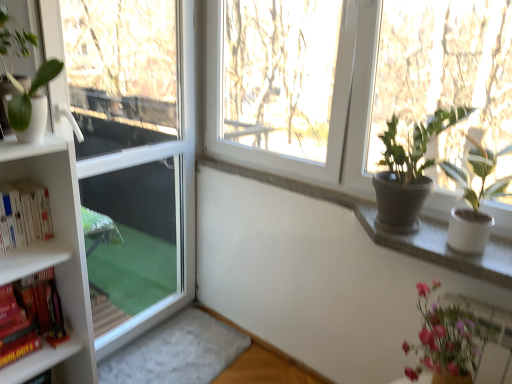
Describe the element at coordinates (15, 77) in the screenshot. I see `matte white pot at left, which ranks as the 1th houseplant in top-to-bottom order` at that location.

Find the location of `transparent glass screen door at left`. transparent glass screen door at left is located at coordinates (181, 192).

Does point (430, 187) appear closer or farther from the camera than point (7, 15)?

Point (430, 187) is farther from the camera than point (7, 15).

Which is more to the left, matte gray pot at upper right, acting as the second houseplant starting from the bottom, or matte white pot at left, placed as the third houseplant when sorted from right to left?

matte white pot at left, placed as the third houseplant when sorted from right to left.

Choose the correct answer: Is matte gray pot at upper right, marked as the 2th houseplant in a left-to-right arrangement, inside matte white pot at left, placed as the third houseplant when sorted from right to left, or outside it?

matte gray pot at upper right, marked as the 2th houseplant in a left-to-right arrangement, exists outside the volume of matte white pot at left, placed as the third houseplant when sorted from right to left.

Based on the photo, can matte gray pot at upper right, the 2th houseplant in the top-to-bottom sequence, be found inside matte white pot at left, which ranks as the 1th houseplant in top-to-bottom order?

No, matte gray pot at upper right, the 2th houseplant in the top-to-bottom sequence, is not inside matte white pot at left, which ranks as the 1th houseplant in top-to-bottom order.

Is matte white pot at left, acting as the 1th houseplant starting from the left, positioned with its back to matte gray pot at upper right, placed as the second houseplant when sorted from right to left?

matte white pot at left, acting as the 1th houseplant starting from the left, does not have its back to matte gray pot at upper right, placed as the second houseplant when sorted from right to left.

Is matte white pot at left, acting as the 1th houseplant starting from the left, shorter than matte gray pot at upper right, the 2th houseplant in the top-to-bottom sequence?

Yes, matte white pot at left, acting as the 1th houseplant starting from the left, is shorter than matte gray pot at upper right, the 2th houseplant in the top-to-bottom sequence.

Which is more to the left, matte white pot at left, acting as the 1th houseplant starting from the left, or matte gray pot at upper right, the 2th houseplant in the top-to-bottom sequence?

matte white pot at left, acting as the 1th houseplant starting from the left, is more to the left.

Who is shorter, pink glossy vase at lower right, which is the 3th houseplant from top to bottom, or hardcover books at left, the second book from the top?

hardcover books at left, the second book from the top, is shorter.

Which is behind, point (473, 324) or point (52, 279)?

The point (52, 279) is farther from the camera.

From a real-world perspective, between pink glossy vase at lower right, acting as the first houseplant starting from the right, and hardcover books at left, the second book from the top, who is vertically higher?

pink glossy vase at lower right, acting as the first houseplant starting from the right, is physically above.

Visually, is transparent glass screen door at left positioned to the left or to the right of matte white pot at left, which ranks as the 1th houseplant in top-to-bottom order?

Clearly, transparent glass screen door at left is on the right of matte white pot at left, which ranks as the 1th houseplant in top-to-bottom order, in the image.

From a real-world perspective, who is located lower, transparent glass screen door at left or matte white pot at left, acting as the 1th houseplant starting from the left?

transparent glass screen door at left is physically lower.

Is the position of transparent glass screen door at left less distant than that of matte white pot at left, which is the third houseplant in bottom-to-top order?

No, transparent glass screen door at left is further to the viewer.

Is transparent glass screen door at left taller or shorter than matte white pot at left, acting as the 1th houseplant starting from the left?

transparent glass screen door at left is taller than matte white pot at left, acting as the 1th houseplant starting from the left.

Between transparent glass screen door at left and hardcover books at left, placed as the 1th book when sorted from top to bottom, which one is positioned in front?

hardcover books at left, placed as the 1th book when sorted from top to bottom.

Identify the location of screen door on the right of hardcover books at left, placed as the 1th book when sorted from top to bottom. This screenshot has height=384, width=512. (181, 192).

Is transparent glass screen door at left turned away from hardcover books at left, which is the 2th book in bottom-to-top order?

transparent glass screen door at left does not have its back to hardcover books at left, which is the 2th book in bottom-to-top order.

From the picture: Is hardcover books at left, which is the 2th book in bottom-to-top order, located within transparent glass screen door at left?

No, transparent glass screen door at left does not contain hardcover books at left, which is the 2th book in bottom-to-top order.

How many degrees apart are the facing directions of matte white pot at left, which is the third houseplant in bottom-to-top order, and white ceramic pot at upper right?

88.7 degrees.

Measure the distance between matte white pot at left, which ranks as the 1th houseplant in top-to-bottom order, and white ceramic pot at upper right.

matte white pot at left, which ranks as the 1th houseplant in top-to-bottom order, and white ceramic pot at upper right are 1.29 meters apart.

Which of these two, matte white pot at left, which ranks as the 1th houseplant in top-to-bottom order, or white ceramic pot at upper right, stands shorter?

Standing shorter between the two is white ceramic pot at upper right.

Is matte white pot at left, which ranks as the 1th houseplant in top-to-bottom order, positioned behind white ceramic pot at upper right?

No, matte white pot at left, which ranks as the 1th houseplant in top-to-bottom order, is closer to the camera.

From the image's perspective, is hardcover books at left, which is the 2th book in bottom-to-top order, positioned above or below pink glossy vase at lower right, which is counted as the first houseplant, starting from the bottom?

From the image's perspective, hardcover books at left, which is the 2th book in bottom-to-top order, appears above pink glossy vase at lower right, which is counted as the first houseplant, starting from the bottom.

From a real-world perspective, between hardcover books at left, placed as the 1th book when sorted from top to bottom, and pink glossy vase at lower right, acting as the first houseplant starting from the right, who is vertically lower?

In real-world perspective, pink glossy vase at lower right, acting as the first houseplant starting from the right, is lower.

At what (x,y) coordinates should I click in order to perform the action: click on book above the pink glossy vase at lower right, which is the 3th houseplant from top to bottom (from a real-world perspective). Please return your answer as a coordinate pair (x, y). This screenshot has height=384, width=512. Looking at the image, I should click on click(24, 214).

Is hardcover books at left, which is the 2th book in bottom-to-top order, oriented away from pink glossy vase at lower right, which is the 3th houseplant from top to bottom?

No, pink glossy vase at lower right, which is the 3th houseplant from top to bottom, is not at the back of hardcover books at left, which is the 2th book in bottom-to-top order.

This screenshot has width=512, height=384. I want to click on the 1st houseplant located beneath the matte white pot at left, placed as the third houseplant when sorted from right to left (from a real-world perspective), so click(x=408, y=171).

You are a GUI agent. You are given a task and a screenshot of the screen. Output one action in this format:
    pyautogui.click(x=<x>, y=<y>)
    Task: Click on the houseplant on the left of matte gray pot at upper right, the 2th houseplant in the top-to-bottom sequence
    The height and width of the screenshot is (384, 512).
    Given the screenshot: What is the action you would take?
    pyautogui.click(x=15, y=77)

Looking at the image, which one is located further to transparent glass screen door at left, pink glossy vase at lower right, the 3th houseplant when ordered from left to right, or hardcover books at left, placed as the 1th book when sorted from top to bottom?

pink glossy vase at lower right, the 3th houseplant when ordered from left to right, is further to transparent glass screen door at left.

Estimate the real-world distances between objects in this image. Which object is closer to matte gray pot at upper right, marked as the 2th houseplant in a left-to-right arrangement, hardcover books at left, the second book from the top, or transparent glass screen door at left?

Among the two, transparent glass screen door at left is located nearer to matte gray pot at upper right, marked as the 2th houseplant in a left-to-right arrangement.

Estimate the real-world distances between objects in this image. Which object is further from transparent glass screen door at left, white ceramic pot at upper right or hardcover books at left, the first book ordered from the bottom?

The object further to transparent glass screen door at left is white ceramic pot at upper right.

Based on their spatial positions, is hardcover books at left, the second book from the top, or matte gray pot at upper right, placed as the second houseplant when sorted from right to left, closer to matte white pot at left, acting as the 1th houseplant starting from the left?

hardcover books at left, the second book from the top.

Considering their positions, is transparent glass screen door at left positioned closer to hardcover books at left, placed as the 1th book when sorted from top to bottom, than pink glossy vase at lower right, which is counted as the first houseplant, starting from the bottom?

transparent glass screen door at left is positioned closer to the anchor hardcover books at left, placed as the 1th book when sorted from top to bottom.

Estimate the real-world distances between objects in this image. Which object is further from transparent glass screen door at left, hardcover books at left, the second book from the top, or pink glossy vase at lower right, which is the 3th houseplant from top to bottom?

pink glossy vase at lower right, which is the 3th houseplant from top to bottom, is further to transparent glass screen door at left.

Based on their spatial positions, is hardcover books at left, placed as the 1th book when sorted from top to bottom, or matte white pot at left, acting as the 1th houseplant starting from the left, further from transparent glass screen door at left?

The object further to transparent glass screen door at left is matte white pot at left, acting as the 1th houseplant starting from the left.

Consider the image. Looking at the image, which one is located closer to hardcover books at left, the first book ordered from the bottom, transparent glass screen door at left or hardcover books at left, placed as the 1th book when sorted from top to bottom?

Based on the image, hardcover books at left, placed as the 1th book when sorted from top to bottom, appears to be nearer to hardcover books at left, the first book ordered from the bottom.

This screenshot has height=384, width=512. Identify the location of screen door between hardcover books at left, placed as the 1th book when sorted from top to bottom, and matte gray pot at upper right, marked as the 2th houseplant in a left-to-right arrangement, from left to right. (181, 192).

What are the coordinates of `book situated between hardcover books at left, the first book ordered from the bottom, and white ceramic pot at upper right from left to right` in the screenshot? It's located at (24, 214).

Identify the location of window sill between matte gray pot at upper right, placed as the second houseplant when sorted from right to left, and pink glossy vase at lower right, which is the 3th houseplant from top to bottom, in the vertical direction. (443, 248).

You are a GUI agent. You are given a task and a screenshot of the screen. Output one action in this format:
    pyautogui.click(x=<x>, y=<y>)
    Task: Click on the screen door situated between hardcover books at left, placed as the 1th book when sorted from top to bottom, and pink glossy vase at lower right, the 3th houseplant when ordered from left to right, from left to right
    Image resolution: width=512 pixels, height=384 pixels.
    Given the screenshot: What is the action you would take?
    pyautogui.click(x=181, y=192)